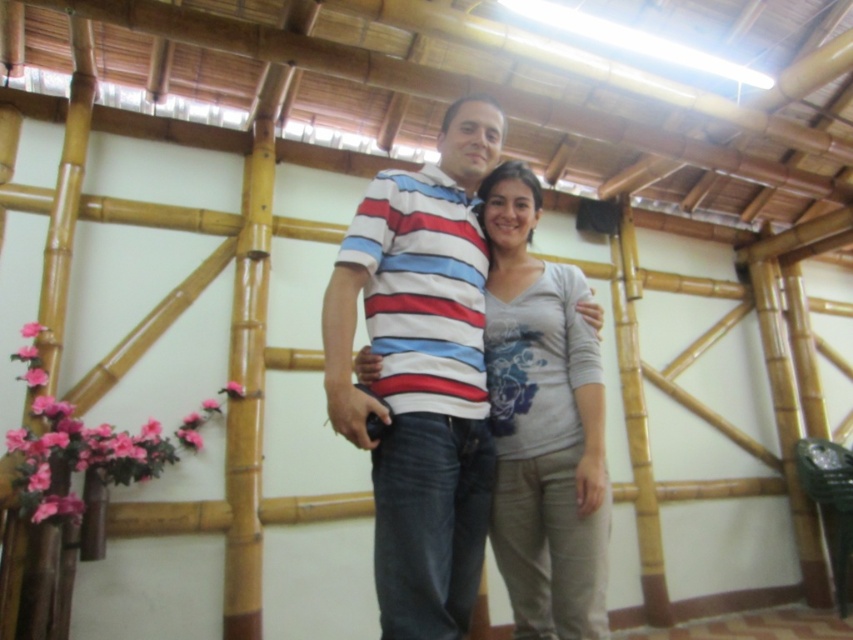
You are a photographer trying to decide which of the two shirts in the image will fit better into a rectangular frame. Given that the striped cotton shirt at center and the gray cotton shirt at center are both in the center, which shirt should you choose to ensure it fits within the frame without cropping?

The gray cotton shirt at center has a smaller width compared to the striped cotton shirt at center, so choosing the gray cotton shirt at center would ensure it fits better within the rectangular frame without cropping.

You are standing at point (325, 316) and want to take a photo of the camera. Can you reach the camera from your current position without moving?

The distance between point (325, 316) and the camera is 5.15 feet, so you cannot reach the camera from your current position without moving since the distance is too far.